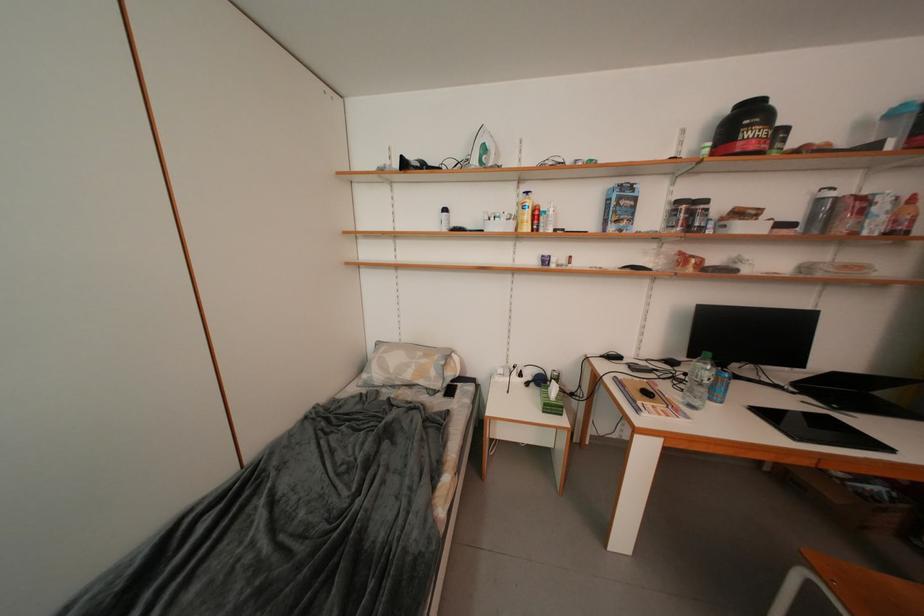
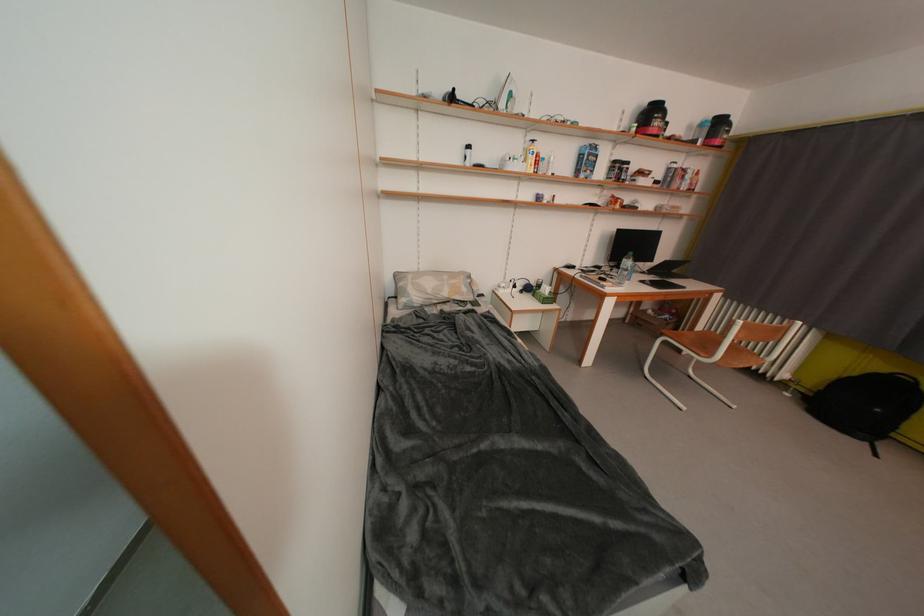
The point at [411,168] is marked in the first image. Where is the corresponding point in the second image?

(459, 100)